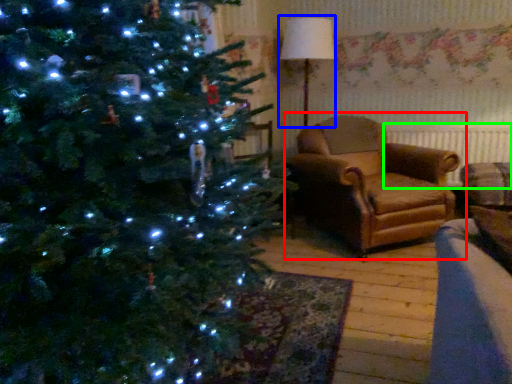
Question: Which object is the closest to the studio couch (highlighted by a red box)? Choose among these: lamp (highlighted by a blue box) or radiator (highlighted by a green box).

Choices:
 (A) lamp
 (B) radiator

Answer: (B)